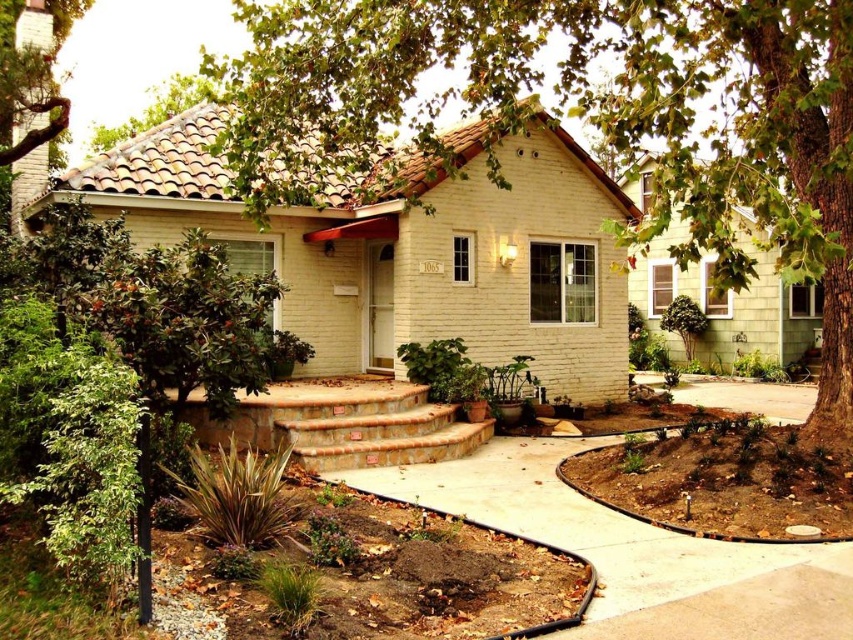
You are a gardener planning to plant new flowers along the brown concrete path at lower center and the green leafy tree at upper left. Which area requires more space for planting?

The green leafy tree at upper left requires more space for planting because it occupies more area than the brown concrete path at lower center.

You are standing at the entrance of the house and want to walk to the green leafy tree at upper left. Which direction should you go from the brown concrete path at lower center?

The brown concrete path at lower center is in front of the green leafy tree at upper left, so you should walk forward along the brown concrete path at lower center towards the tree.